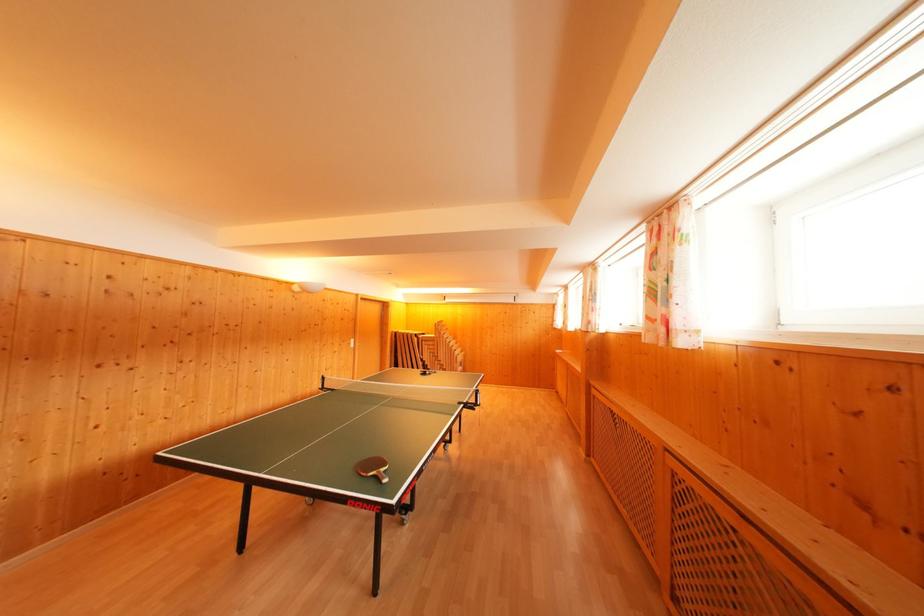
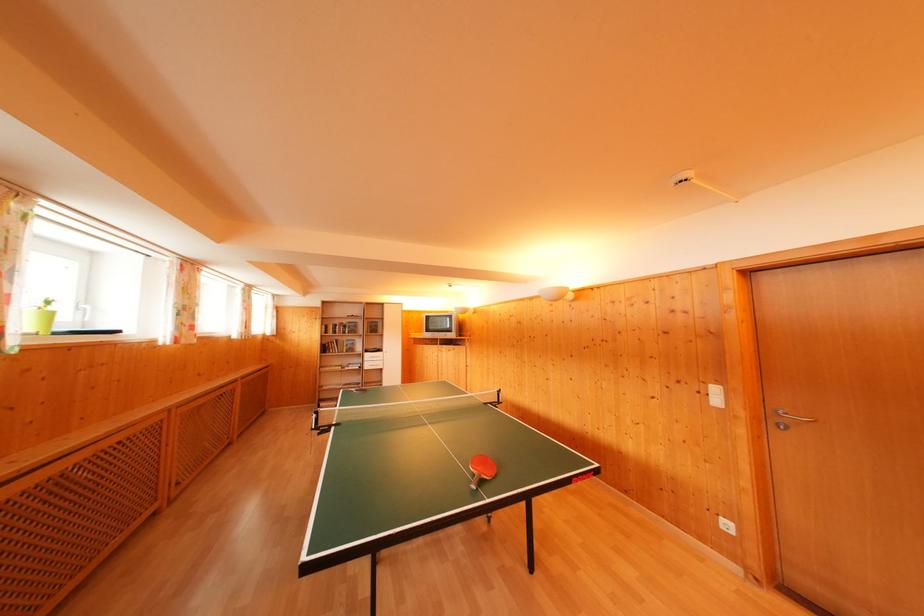
In the second image, find the point that corresponds to (x=358, y=346) in the first image.

(721, 395)